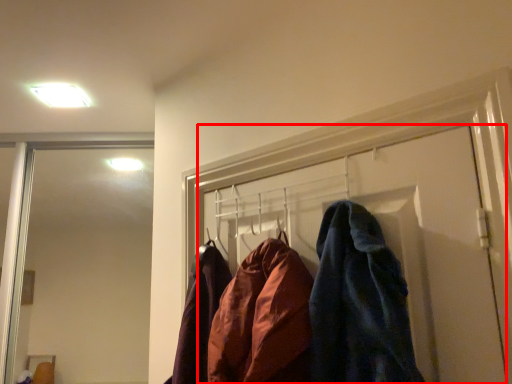
Question: Considering the relative positions of door (annotated by the red box) and light fixture in the image provided, where is door (annotated by the red box) located with respect to the staircase?

Choices:
 (A) right
 (B) left

Answer: (A)